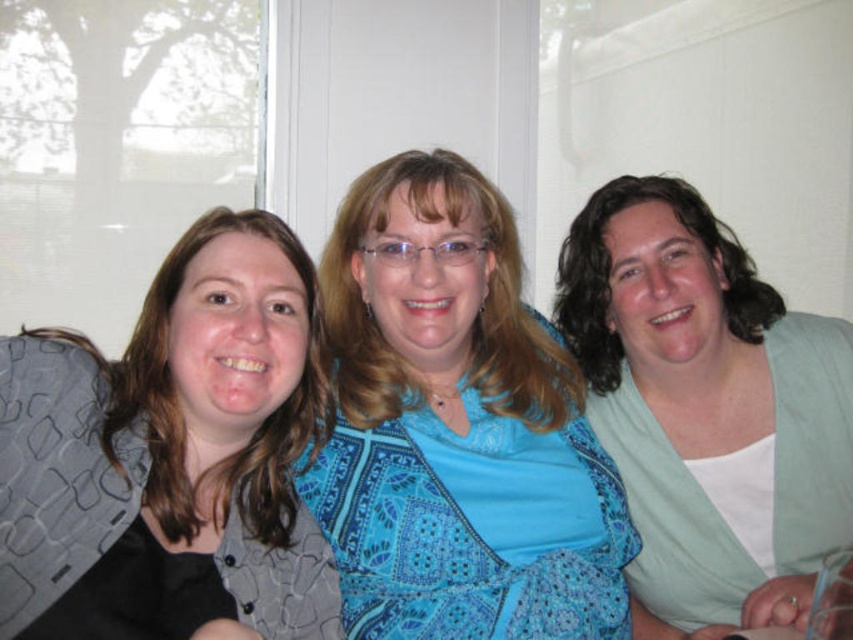
You are a photographer trying to capture a closeup of the matte gray vest at left and the white matte shirt at right. Which one will appear larger in your photo?

The matte gray vest at left will appear larger in the photo because it is closer to the viewer than the white matte shirt at right.

You are a photographer setting up a shoot in the living room. You need to place a small prop between the matte gray vest at left and the white matte shirt at right. Based on their positions, where should you place the prop to ensure it is centered between them?

The prop should be placed between the matte gray vest at left and the white matte shirt at right since the matte gray vest at left is to the left of white matte shirt at right.